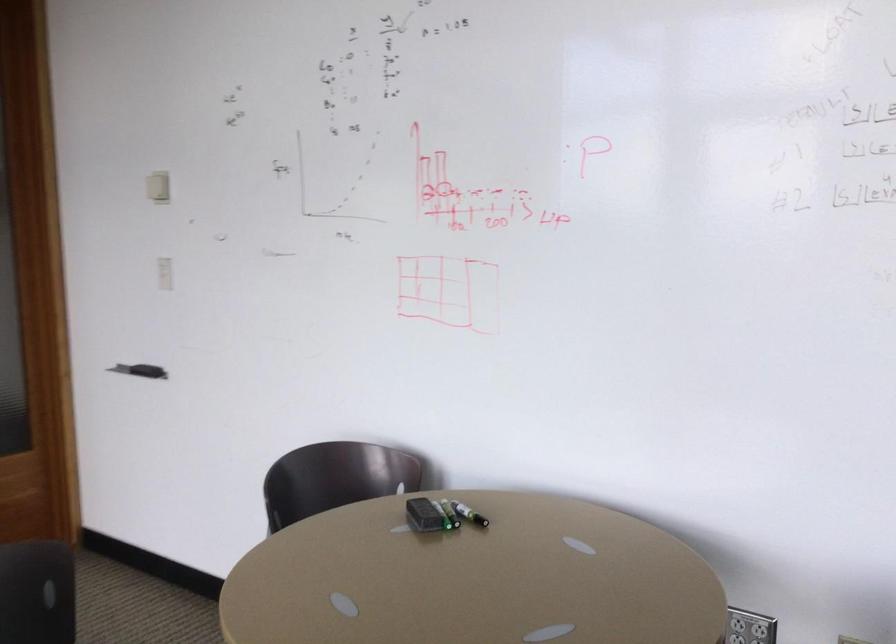
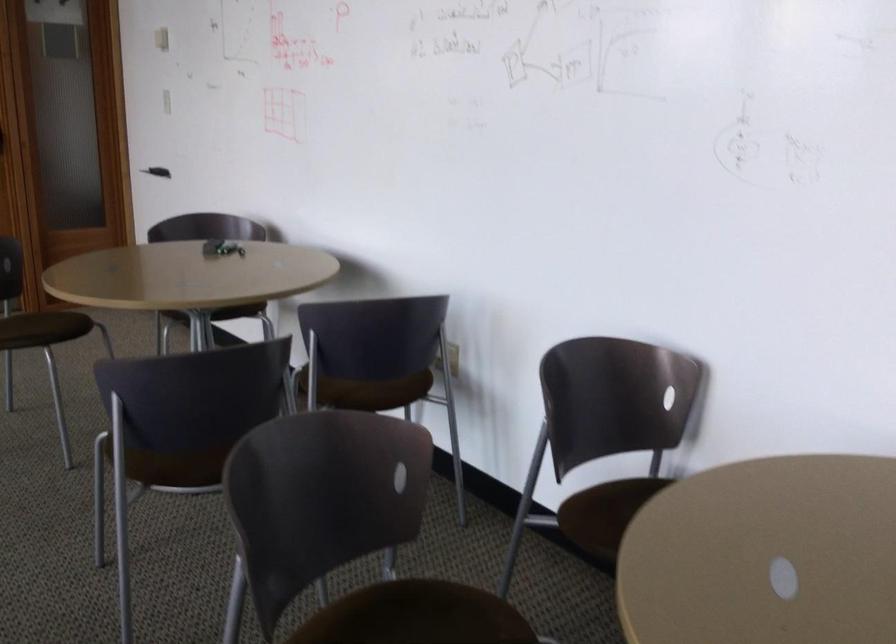
In the second image, find the point that corresponds to point (440, 536) in the first image.

(221, 248)